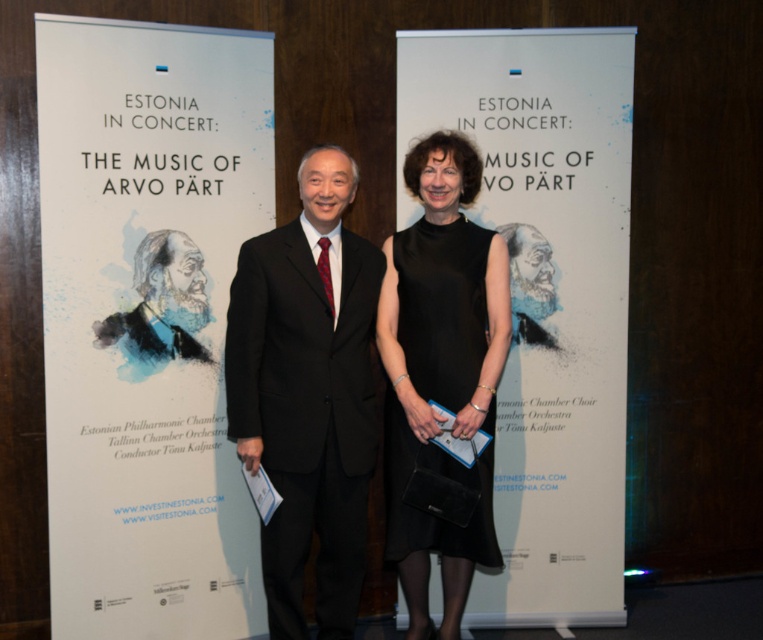
Between white paper at center and black satin dress at center, which one is positioned higher?

white paper at center is above.

Can you confirm if white paper at center is shorter than black satin dress at center?

Incorrect, white paper at center's height does not fall short of black satin dress at center's.

At what (x,y) coordinates should I click in order to perform the action: click on white paper at center. Please return your answer as a coordinate pair (x, y). Looking at the image, I should click on (543, 296).

Can you confirm if black satin dress at center is taller than blue textured portrait at center?

Yes, black satin dress at center is taller than blue textured portrait at center.

Is point (409, 276) positioned behind point (158, 321)?

No, (409, 276) is closer to viewer.

Locate an element on the screen. This screenshot has width=763, height=640. black satin dress at center is located at coordinates (443, 307).

Does white paper at center have a smaller size compared to blue textured portrait at center?

No, white paper at center is not smaller than blue textured portrait at center.

Can you confirm if white paper at center is positioned below blue textured portrait at center?

Yes, white paper at center is below blue textured portrait at center.

What do you see at coordinates (543, 296) in the screenshot? I see `white paper at center` at bounding box center [543, 296].

The height and width of the screenshot is (640, 763). I want to click on white paper at center, so [x=543, y=296].